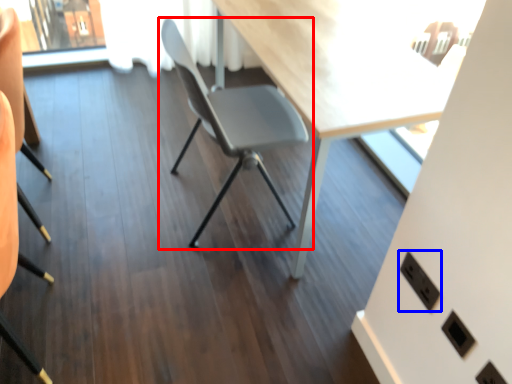
Question: Which object appears farthest to the camera in this image, chair (highlighted by a red box) or electric outlet (highlighted by a blue box)?

Choices:
 (A) chair
 (B) electric outlet

Answer: (A)